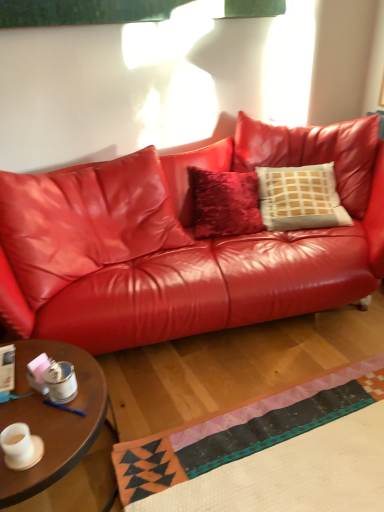
You are a GUI agent. You are given a task and a screenshot of the screen. Output one action in this format:
    pyautogui.click(x=<x>, y=<y>)
    Task: Click on the wooden round table at lower left
    The height and width of the screenshot is (512, 384).
    Given the screenshot: What is the action you would take?
    pyautogui.click(x=53, y=420)

Describe the element at coordinates (300, 198) in the screenshot. I see `white textured pillow at center` at that location.

Measure the distance between point (269, 217) and camera.

Point (269, 217) is 8.05 feet away from camera.

This screenshot has height=512, width=384. Identify the location of glossy leather couch at center. (184, 243).

What do you see at coordinates (184, 243) in the screenshot? This screenshot has width=384, height=512. I see `glossy leather couch at center` at bounding box center [184, 243].

In order to click on wooden round table at lower left in this screenshot , I will do `click(53, 420)`.

You are a GUI agent. You are given a task and a screenshot of the screen. Output one action in this format:
    pyautogui.click(x=<x>, y=<y>)
    Task: Click on the coffee table that is in front of the matte white cup at lower left
    
    Given the screenshot: What is the action you would take?
    pyautogui.click(x=53, y=420)

Based on their positions, is matte white cup at lower left located to the left or right of wooden round table at lower left?

matte white cup at lower left is positioned on wooden round table at lower left's right side.

Considering the sizes of objects matte white cup at lower left and wooden round table at lower left in the image provided, who is taller, matte white cup at lower left or wooden round table at lower left?

wooden round table at lower left.

Is matte white cup at lower left turned away from wooden round table at lower left?

No, matte white cup at lower left is not facing away from wooden round table at lower left.

Between white textured pillow at center and matte white cup at lower left, which one is positioned in front?

matte white cup at lower left is more forward.

Is white textured pillow at center far from matte white cup at lower left?

Yes.

From the image's perspective, is white textured pillow at center on matte white cup at lower left?

Yes.

Looking at this image, measure the distance from white textured pillow at center to matte white cup at lower left.

white textured pillow at center is 6.10 feet from matte white cup at lower left.

Is glossy leather couch at center not near wooden round table at lower left?

No, glossy leather couch at center is not far away from wooden round table at lower left.

Consider the image. Is the depth of glossy leather couch at center greater than that of wooden round table at lower left?

Yes, glossy leather couch at center is further from the viewer.

Does point (210, 292) appear closer or farther from the camera than point (82, 378)?

Point (210, 292) is farther from the camera than point (82, 378).

Is glossy leather couch at center oriented away from wooden round table at lower left?

No, wooden round table at lower left is not at the back of glossy leather couch at center.

Looking at this image, from a real-world perspective, which object rests below the other?

From a 3D spatial view, wooden round table at lower left is below.

Could you tell me if wooden round table at lower left is facing glossy leather couch at center?

No.

Do you think wooden round table at lower left is within glossy leather couch at center, or outside of it?

The correct answer is: outside.

Could you tell me if wooden round table at lower left is facing matte white cup at lower left?

No, wooden round table at lower left is not facing towards matte white cup at lower left.

Which is in front, wooden round table at lower left or matte white cup at lower left?

wooden round table at lower left.

Looking at this image, does wooden round table at lower left appear on the right side of matte white cup at lower left?

Incorrect, wooden round table at lower left is not on the right side of matte white cup at lower left.

Considering the relative sizes of wooden round table at lower left and white textured pillow at center in the image provided, is wooden round table at lower left bigger than white textured pillow at center?

Incorrect, wooden round table at lower left is not larger than white textured pillow at center.

Is wooden round table at lower left taller than white textured pillow at center?

Incorrect, the height of wooden round table at lower left is not larger of that of white textured pillow at center.

Which is closer to the camera, (44, 469) or (342, 212)?

The point (44, 469) is closer.

Where is `coffee table in front of the white textured pillow at center`? The image size is (384, 512). coffee table in front of the white textured pillow at center is located at coordinates (53, 420).

Locate an element on the screen. The width and height of the screenshot is (384, 512). pillow located above the wooden round table at lower left (from the image's perspective) is located at coordinates (300, 198).

Considering the relative sizes of white textured pillow at center and wooden round table at lower left in the image provided, is white textured pillow at center smaller than wooden round table at lower left?

No, white textured pillow at center is not smaller than wooden round table at lower left.

In the scene shown: Can you confirm if white textured pillow at center is taller than wooden round table at lower left?

Yes, white textured pillow at center is taller than wooden round table at lower left.

The width and height of the screenshot is (384, 512). Find the location of `coffee table below the matte white cup at lower left (from the image's perspective)`. coffee table below the matte white cup at lower left (from the image's perspective) is located at coordinates (53, 420).

Find the location of `pillow above the matte white cup at lower left (from the image's perspective)`. pillow above the matte white cup at lower left (from the image's perspective) is located at coordinates (300, 198).

Looking at this image, considering their positions, is glossy leather couch at center positioned further to wooden round table at lower left than white textured pillow at center?

white textured pillow at center lies further to wooden round table at lower left than the other object.

Based on their spatial positions, is white textured pillow at center or matte white cup at lower left closer to wooden round table at lower left?

Based on the image, matte white cup at lower left appears to be nearer to wooden round table at lower left.

Considering their positions, is glossy leather couch at center positioned further to matte white cup at lower left than wooden round table at lower left?

Based on the image, glossy leather couch at center appears to be further to matte white cup at lower left.

Looking at the image, which one is located closer to wooden round table at lower left, matte white cup at lower left or glossy leather couch at center?

Among the two, matte white cup at lower left is located nearer to wooden round table at lower left.

Considering their positions, is wooden round table at lower left positioned further to glossy leather couch at center than matte white cup at lower left?

matte white cup at lower left.

Which object lies further to the anchor point matte white cup at lower left, wooden round table at lower left or glossy leather couch at center?

glossy leather couch at center is positioned further to the anchor matte white cup at lower left.

Which object lies nearer to the anchor point matte white cup at lower left, wooden round table at lower left or white textured pillow at center?

wooden round table at lower left lies closer to matte white cup at lower left than the other object.

In the scene shown: From the image, which object appears to be nearer to white textured pillow at center, glossy leather couch at center or matte white cup at lower left?

glossy leather couch at center is closer to white textured pillow at center.

Where is `studio couch between wooden round table at lower left and white textured pillow at center from left to right`? The image size is (384, 512). studio couch between wooden round table at lower left and white textured pillow at center from left to right is located at coordinates (184, 243).

Locate an element on the screen. coffee cup between glossy leather couch at center and wooden round table at lower left in the up-down direction is located at coordinates (17, 445).

Locate an element on the screen. studio couch between matte white cup at lower left and white textured pillow at center in the horizontal direction is located at coordinates (184, 243).

Where is `coffee cup between wooden round table at lower left and white textured pillow at center from left to right`? coffee cup between wooden round table at lower left and white textured pillow at center from left to right is located at coordinates (17, 445).